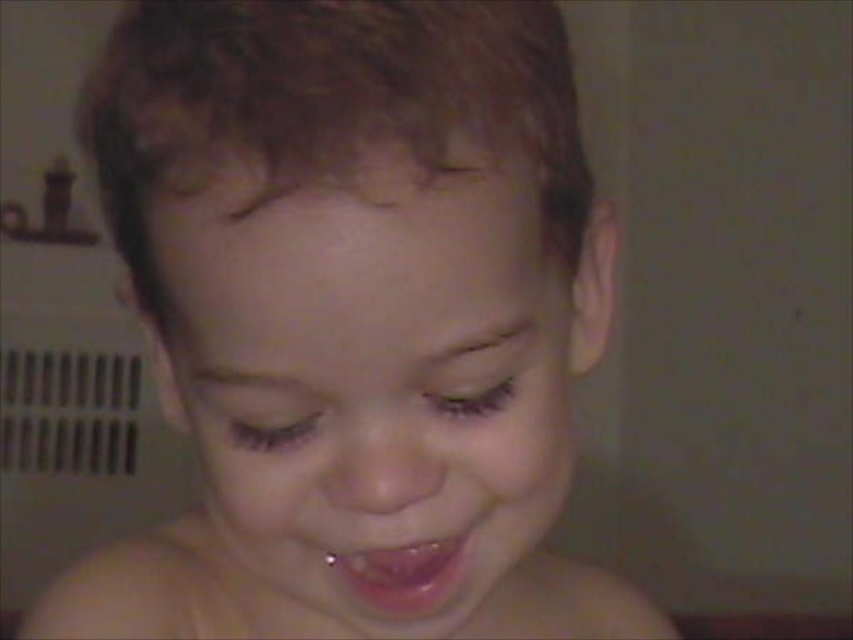
You are a photographer trying to capture a close up of the child in the image. You want to focus on the pink glossy lips at center and the metallic gold toy at upper left. Which object should you adjust your camera focus to first if you want to capture the taller object?

The metallic gold toy at upper left is taller than the pink glossy lips at center, so you should focus on the metallic gold toy at upper left first.

Based on the scene description, which object is thinner between the pink glossy lips at center and the metallic gold toy at upper left?

The pink glossy lips at center is thinner than the metallic gold toy at upper left according to the description.